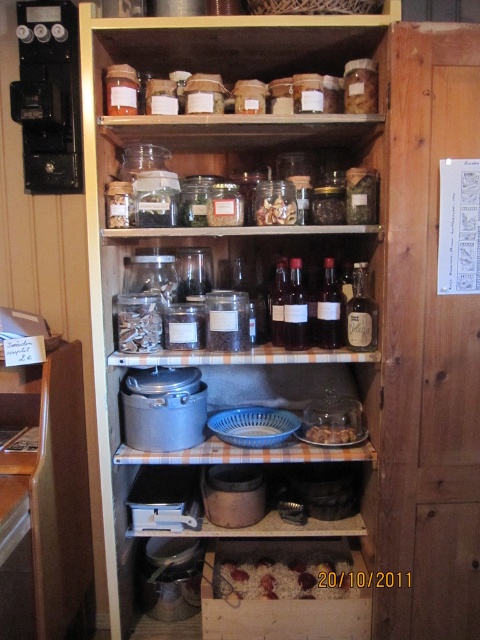
Between point (252, 228) and point (262, 556), which one is positioned behind?

The point (262, 556) is behind.

Does point (323, 230) come closer to viewer compared to point (237, 564)?

Yes, point (323, 230) is in front of point (237, 564).

Which is behind, point (168, 227) or point (295, 595)?

The point (295, 595) is more distant.

The height and width of the screenshot is (640, 480). I want to click on clear glass jars at upper center, so click(x=254, y=216).

Is clear glass jars at upper center positioned before translucent glass jar at lower center?

Yes, it is in front of translucent glass jar at lower center.

Is clear glass jars at upper center bigger than translucent glass jar at lower center?

Yes.

Is point (285, 182) closer to viewer compared to point (319, 440)?

Yes, point (285, 182) is in front of point (319, 440).

Identify the location of clear glass jars at upper center. This screenshot has height=640, width=480. (254, 216).

Is clear glass bottles at center bigger than brown crumbly food at lower center?

Yes, clear glass bottles at center is bigger than brown crumbly food at lower center.

Does clear glass bottles at center come behind brown crumbly food at lower center?

No, clear glass bottles at center is in front of brown crumbly food at lower center.

Image resolution: width=480 pixels, height=640 pixels. Describe the element at coordinates (240, 355) in the screenshot. I see `clear glass bottles at center` at that location.

The height and width of the screenshot is (640, 480). Identify the location of clear glass bottles at center. (240, 355).